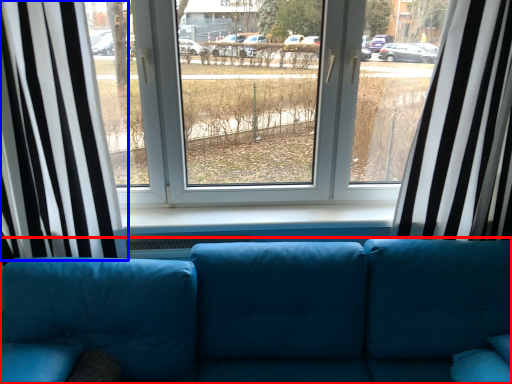
Question: Which point is further to the camera, studio couch (highlighted by a red box) or curtain (highlighted by a blue box)?

Choices:
 (A) studio couch
 (B) curtain

Answer: (B)